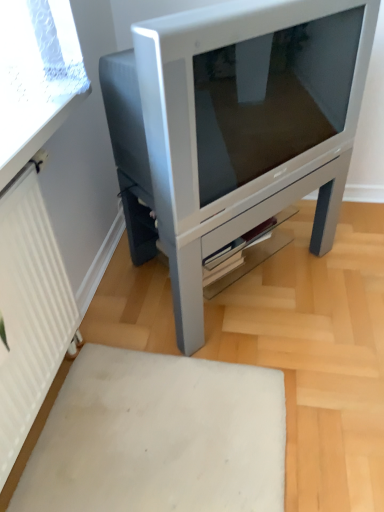
Question: Considering the positions of satin silver television at center and white ribbed radiator at left in the image, is satin silver television at center taller or shorter than white ribbed radiator at left?

Choices:
 (A) tall
 (B) short

Answer: (B)

Question: Considering the relative positions of satin silver television at center and white ribbed radiator at left in the image provided, is satin silver television at center to the left or to the right of white ribbed radiator at left?

Choices:
 (A) right
 (B) left

Answer: (A)

Question: Which of these objects is positioned farthest from the white matte rug at lower center?

Choices:
 (A) white ribbed radiator at left
 (B) satin silver television at center

Answer: (B)

Question: Which object is positioned closest to the white matte rug at lower center?

Choices:
 (A) white ribbed radiator at left
 (B) satin silver television at center

Answer: (A)